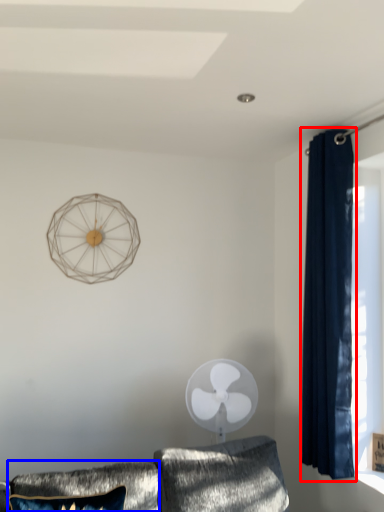
Question: Which object appears farthest to the camera in this image, curtain (highlighted by a red box) or pillow (highlighted by a blue box)?

Choices:
 (A) curtain
 (B) pillow

Answer: (A)